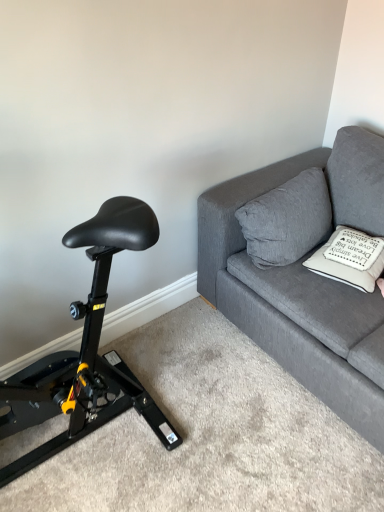
Where is `vacant region to the right of black leather saddle at left`? The width and height of the screenshot is (384, 512). vacant region to the right of black leather saddle at left is located at coordinates (232, 423).